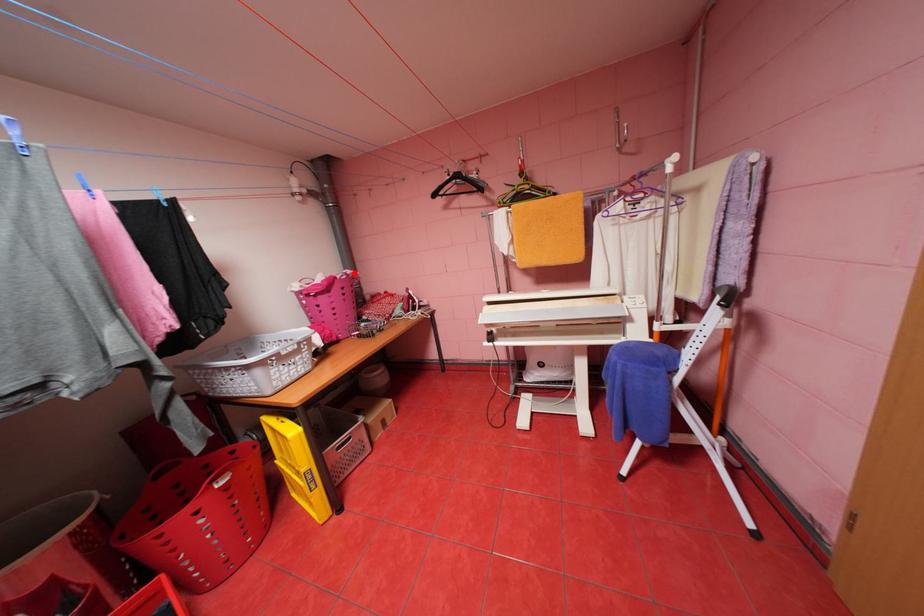
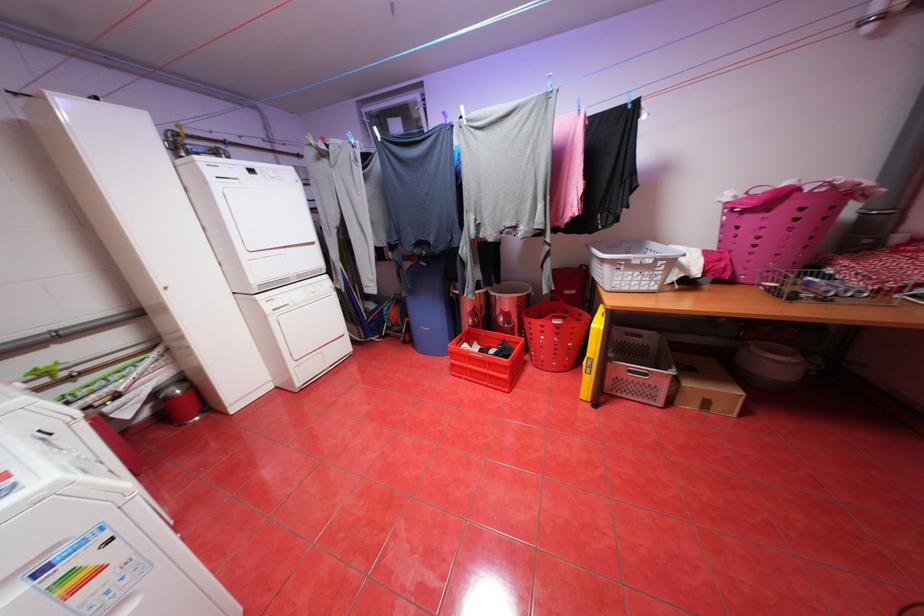
Question: I am providing you with two images of the same scene from different viewpoints. Given a red point in image1, look at the same physical point in image2. Is it:

Choices:
 (A) Closer to the viewpoint
 (B) Farther from the viewpoint

Answer: (B)